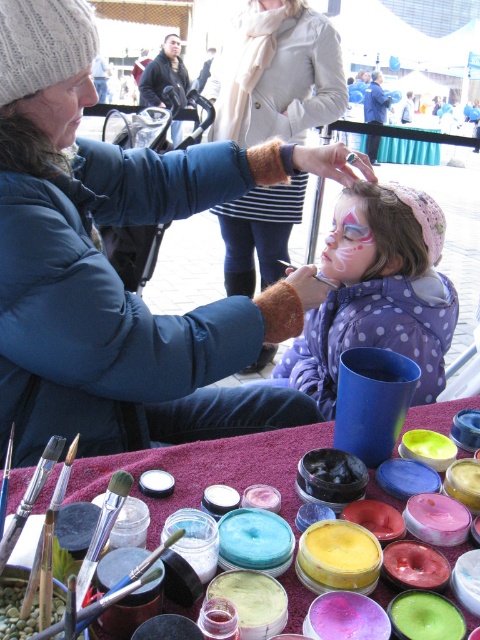
Question: Considering the real-world distances, which object is closest to the maroon fabric at lower center?

Choices:
 (A) black bristle paintbrush at upper center
 (B) matte blue coat at center

Answer: (B)

Question: Which object is farther from the camera taking this photo?

Choices:
 (A) pastel dotted jacket at center
 (B) matte blue coat at center

Answer: (A)

Question: Can you confirm if matte blue coat at center is wider than pastel dotted jacket at center?

Choices:
 (A) yes
 (B) no

Answer: (A)

Question: Is pastel dotted jacket at center to the left of black bristle paintbrush at upper center from the viewer's perspective?

Choices:
 (A) no
 (B) yes

Answer: (A)

Question: Which of the following is the farthest from the observer?

Choices:
 (A) (284, 262)
 (B) (224, 474)
 (C) (208, 400)
 (D) (422, 337)

Answer: (A)

Question: Does pastel dotted jacket at center have a smaller size compared to black bristle paintbrush at upper center?

Choices:
 (A) yes
 (B) no

Answer: (B)